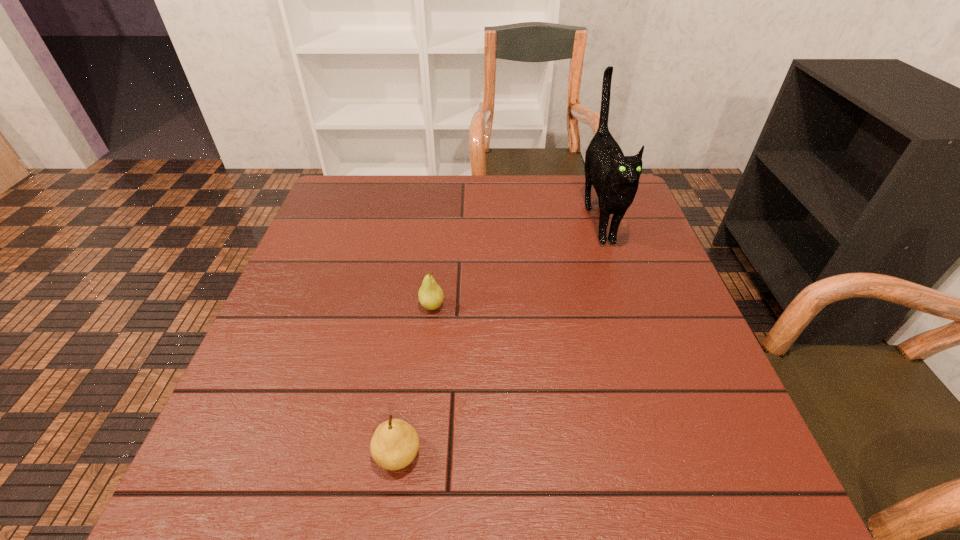
The image size is (960, 540). What are the coordinates of `cat` in the screenshot? It's located at (615, 177).

Image resolution: width=960 pixels, height=540 pixels. What are the coordinates of `the tallest object` in the screenshot? It's located at (615, 177).

The height and width of the screenshot is (540, 960). I want to click on the second nearest object, so click(x=431, y=296).

At what (x,y) coordinates should I click in order to perform the action: click on the nearer pear. Please return your answer as a coordinate pair (x, y). The image size is (960, 540). Looking at the image, I should click on (395, 443).

Locate an element on the screen. free space located on the face of the tallest object is located at coordinates (636, 330).

I want to click on vacant area situated 0.070m on the back of the farther pear, so click(x=435, y=276).

Image resolution: width=960 pixels, height=540 pixels. I want to click on vacant area located on the left of the nearer pear, so click(332, 455).

Find the location of a particular element. This screenshot has height=540, width=960. object that is at the far edge is located at coordinates (615, 177).

Image resolution: width=960 pixels, height=540 pixels. I want to click on object that is at the near edge, so click(x=395, y=443).

Where is `object that is at the right edge`? Image resolution: width=960 pixels, height=540 pixels. object that is at the right edge is located at coordinates (615, 177).